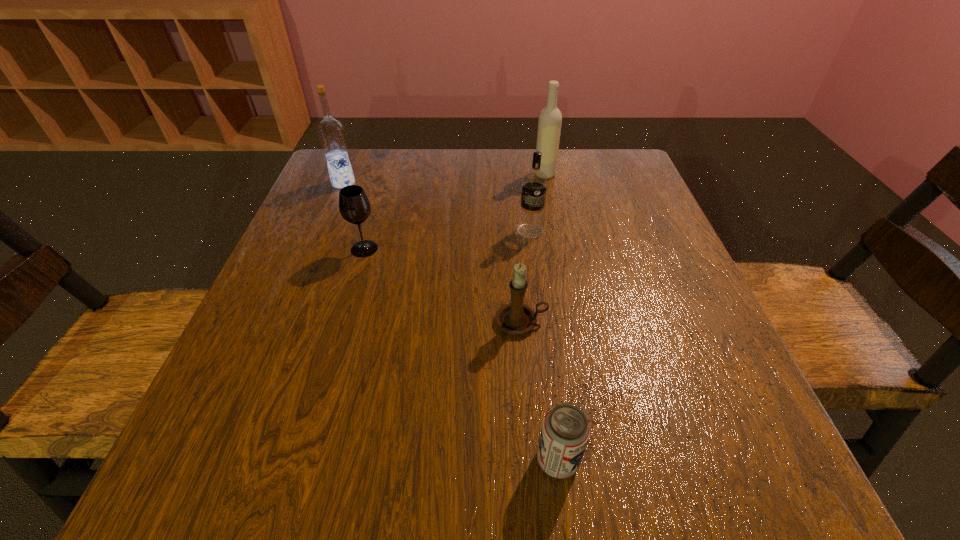
I want to click on object that stands as the fifth closest to the leftmost object, so click(565, 431).

The height and width of the screenshot is (540, 960). Find the location of `vodka that stands as the closest to the leftmost vodka`. vodka that stands as the closest to the leftmost vodka is located at coordinates (534, 183).

The image size is (960, 540). In order to click on vodka that is the closest to the candle holder in this screenshot , I will do `click(534, 183)`.

The image size is (960, 540). What are the coordinates of `vacant region that satisfies the following two spatial constraints: 1. on the label of the shortest vodka; 2. on the side of the candle holder with the handle` in the screenshot? It's located at (542, 321).